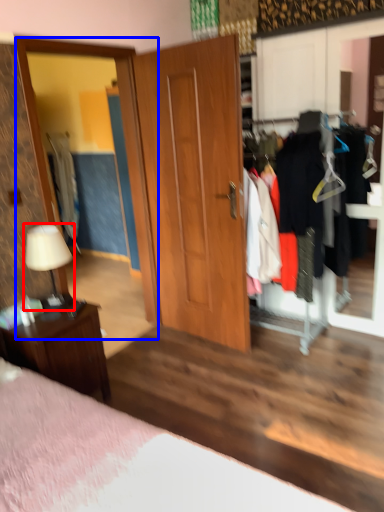
Question: Which point is closer to the camera, table lamp (highlighted by a red box) or mirror (highlighted by a blue box)?

Choices:
 (A) table lamp
 (B) mirror

Answer: (A)